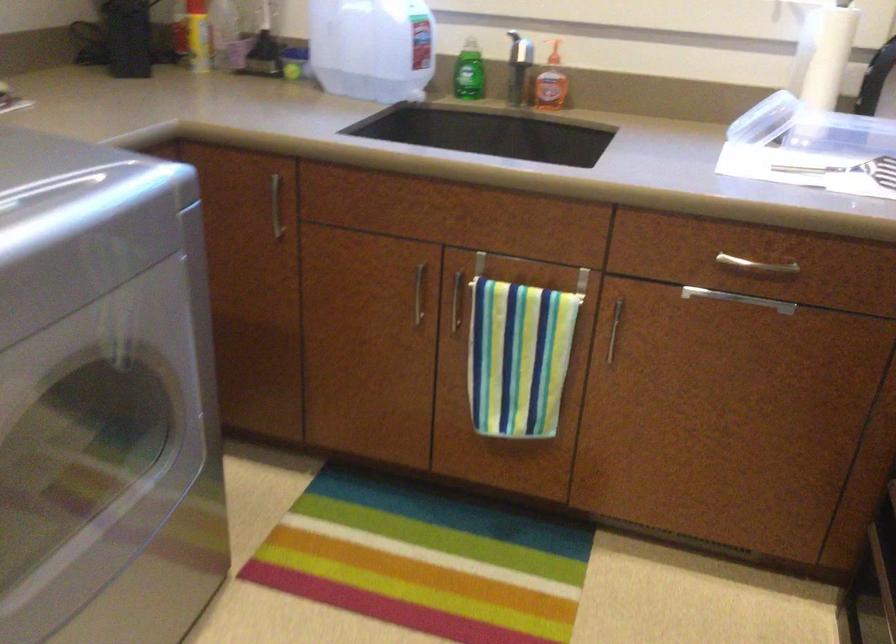
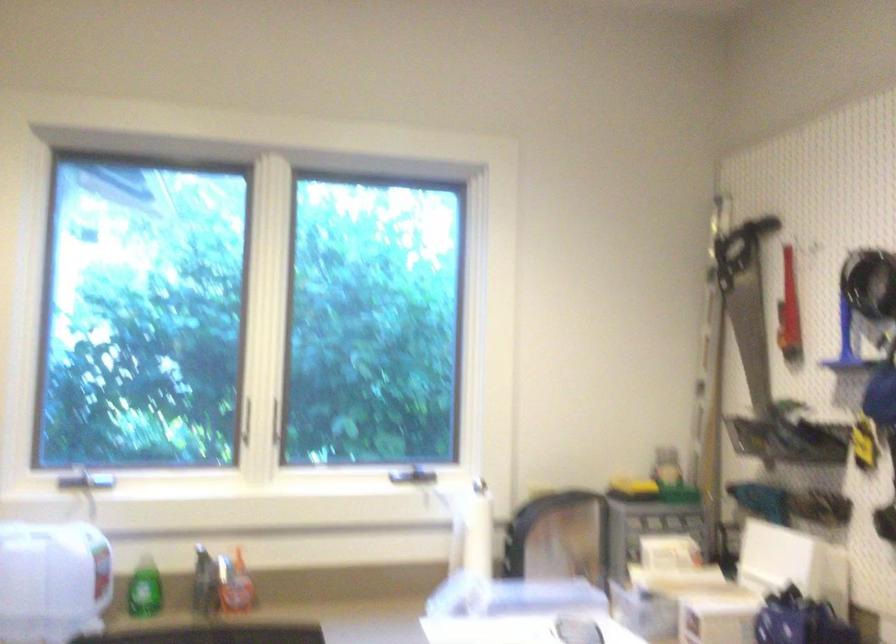
Based on the continuous images, in which direction is the camera rotating?

The camera rotated toward right-up.